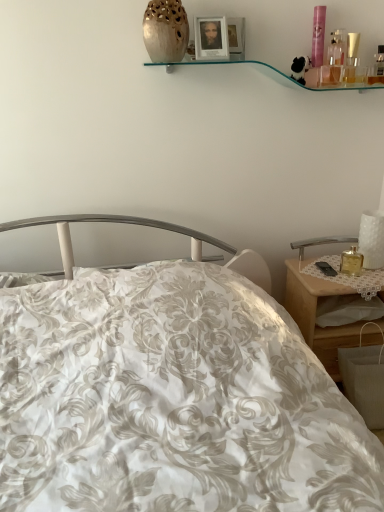
You are a GUI agent. You are given a task and a screenshot of the screen. Output one action in this format:
    pyautogui.click(x=<x>, y=<y>)
    Task: Click on the wooden nightstand at right
    
    Given the screenshot: What is the action you would take?
    pyautogui.click(x=317, y=313)

Which point is more forward, (185,39) or (324,296)?

Point (185,39)

Which object is thinner, matte beige vase at upper center or wooden nightstand at right?

With smaller width is matte beige vase at upper center.

From the image's perspective, relative to wooden nightstand at right, is matte beige vase at upper center above or below?

Based on their image positions, matte beige vase at upper center is located above wooden nightstand at right.

Is matte beige vase at upper center not inside wooden nightstand at right?

Yes, matte beige vase at upper center is located beyond the bounds of wooden nightstand at right.

Is matte wooden picture frame at upper center taller than wooden nightstand at right?

No.

From the image's perspective, which is above, matte wooden picture frame at upper center or wooden nightstand at right?

matte wooden picture frame at upper center, from the image's perspective.

Is matte wooden picture frame at upper center wider than wooden nightstand at right?

In fact, matte wooden picture frame at upper center might be narrower than wooden nightstand at right.

Is wooden nightstand at right completely or partially inside matte wooden picture frame at upper center?

No, wooden nightstand at right is located outside of matte wooden picture frame at upper center.

How different are the orientations of wooden nightstand at right and matte wooden picture frame at upper center in degrees?

→ The facing directions of wooden nightstand at right and matte wooden picture frame at upper center are 1.25 degrees apart.

Considering the relative positions of wooden nightstand at right and matte wooden picture frame at upper center in the image provided, is wooden nightstand at right to the left of matte wooden picture frame at upper center from the viewer's perspective?

Incorrect, wooden nightstand at right is not on the left side of matte wooden picture frame at upper center.

In the scene shown: Is wooden nightstand at right bigger than matte wooden picture frame at upper center?

Yes, wooden nightstand at right is bigger than matte wooden picture frame at upper center.

From the image's perspective, between wooden nightstand at right and matte wooden picture frame at upper center, which one is located above?

From the image's view, matte wooden picture frame at upper center is above.

From a real-world perspective, is wooden nightstand at right on matte beige vase at upper center?

No, from a real-world perspective, wooden nightstand at right is not over matte beige vase at upper center

In the scene shown: From the image's perspective, is wooden nightstand at right under matte beige vase at upper center?

Indeed, from the image's perspective, wooden nightstand at right is shown beneath matte beige vase at upper center.

Is wooden nightstand at right turned away from matte beige vase at upper center?

No, matte beige vase at upper center is not at the back of wooden nightstand at right.

Is point (366, 334) farther from viewer compared to point (183, 19)?

Yes, point (366, 334) is behind point (183, 19).

What's the angular difference between matte beige vase at upper center and matte wooden picture frame at upper center's facing directions?

The facing directions of matte beige vase at upper center and matte wooden picture frame at upper center are 8.5e-05 degrees apart.

From a real-world perspective, relative to matte wooden picture frame at upper center, is matte beige vase at upper center vertically above or below?

Answer: matte beige vase at upper center is situated higher than matte wooden picture frame at upper center in the real world.

Find the location of a particular element. picture frame behind the matte beige vase at upper center is located at coordinates (211, 38).

Does matte beige vase at upper center appear on the left side of matte wooden picture frame at upper center?

Indeed, matte beige vase at upper center is positioned on the left side of matte wooden picture frame at upper center.

In the scene shown: Which object is closer to the camera, matte wooden picture frame at upper center or matte beige vase at upper center?

matte beige vase at upper center is more forward.

In the scene shown: Could you tell me if matte wooden picture frame at upper center is turned towards matte beige vase at upper center?

No, matte wooden picture frame at upper center is not oriented towards matte beige vase at upper center.

Can you confirm if matte wooden picture frame at upper center is bigger than matte beige vase at upper center?

No.

What are the coordinates of `vase to the left of wooden nightstand at right` in the screenshot? It's located at pos(165,31).

At what (x,y) coordinates should I click in order to perform the action: click on desk to the right of matte wooden picture frame at upper center. Please return your answer as a coordinate pair (x, y). Looking at the image, I should click on (317, 313).

Estimate the real-world distances between objects in this image. Which object is closer to matte wooden picture frame at upper center, matte beige vase at upper center or wooden nightstand at right?

The object closer to matte wooden picture frame at upper center is matte beige vase at upper center.

Looking at the image, which one is located closer to matte beige vase at upper center, wooden nightstand at right or matte wooden picture frame at upper center?

Based on the image, matte wooden picture frame at upper center appears to be nearer to matte beige vase at upper center.

Based on their spatial positions, is wooden nightstand at right or matte beige vase at upper center closer to matte wooden picture frame at upper center?

matte beige vase at upper center lies closer to matte wooden picture frame at upper center than the other object.

Looking at the image, which one is located further to wooden nightstand at right, matte beige vase at upper center or matte wooden picture frame at upper center?

matte beige vase at upper center.

When comparing their distances from matte beige vase at upper center, does matte wooden picture frame at upper center or wooden nightstand at right seem closer?

Among the two, matte wooden picture frame at upper center is located nearer to matte beige vase at upper center.

Which object lies further to the anchor point wooden nightstand at right, matte wooden picture frame at upper center or matte beige vase at upper center?

matte beige vase at upper center.

I want to click on picture frame between matte beige vase at upper center and wooden nightstand at right from top to bottom, so click(211, 38).